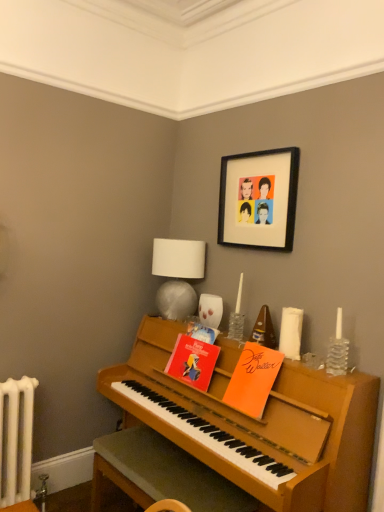
What is the approximate height of black matte picture frame at upper center?

black matte picture frame at upper center is 21.37 inches tall.

The width and height of the screenshot is (384, 512). Describe the element at coordinates (259, 199) in the screenshot. I see `black matte picture frame at upper center` at that location.

Describe the element at coordinates (161, 473) in the screenshot. The image size is (384, 512). I see `wooden piano bench at center` at that location.

What do you see at coordinates (177, 275) in the screenshot? The image size is (384, 512). I see `white fabric lampshade at upper center` at bounding box center [177, 275].

Find the location of a particular element. This screenshot has width=384, height=512. clear glass candle at right is located at coordinates (337, 350).

Find the location of a particular element. black matte picture frame at upper center is located at coordinates (259, 199).

From the image's perspective, which object appears higher, red paper book at center, the third book viewed from the right, or red paper book at center, acting as the 2th book starting from the right?

red paper book at center, acting as the 2th book starting from the right, from the image's perspective.

Is red paper book at center, positioned as the first book in left-to-right order, oriented away from red paper book at center, acting as the 2th book starting from the right?

No, red paper book at center, positioned as the first book in left-to-right order, is not facing the opposite direction of red paper book at center, acting as the 2th book starting from the right.

Between red paper book at center, the third book viewed from the right, and red paper book at center, which is the 2th book in left-to-right order, which one appears on the right side from the viewer's perspective?

From the viewer's perspective, red paper book at center, which is the 2th book in left-to-right order, appears more on the right side.

Can you confirm if red paper book at center, the third book viewed from the right, is thinner than red paper book at center, acting as the 2th book starting from the right?

Incorrect, the width of red paper book at center, the third book viewed from the right, is not less than that of red paper book at center, acting as the 2th book starting from the right.

Is the surface of white fabric lampshade at upper center in direct contact with red paper book at center, positioned as the first book in left-to-right order?

No, white fabric lampshade at upper center is not touching red paper book at center, positioned as the first book in left-to-right order.

Is white fabric lampshade at upper center facing away from red paper book at center, positioned as the first book in left-to-right order?

No, red paper book at center, positioned as the first book in left-to-right order, is not at the back of white fabric lampshade at upper center.

Does white fabric lampshade at upper center lie in front of red paper book at center, positioned as the first book in left-to-right order?

No, white fabric lampshade at upper center is behind red paper book at center, positioned as the first book in left-to-right order.

Is white fabric lampshade at upper center to the right of red paper book at center, the third book viewed from the right, from the viewer's perspective?

Incorrect, white fabric lampshade at upper center is not on the right side of red paper book at center, the third book viewed from the right.

Is clear glass candle at right positioned far away from orange matte book at center, the third book viewed from the left?

No, clear glass candle at right is not far from orange matte book at center, the third book viewed from the left.

Consider the image. From a real-world perspective, is clear glass candle at right positioned above or below orange matte book at center, the third book viewed from the left?

clear glass candle at right is situated higher than orange matte book at center, the third book viewed from the left, in the real world.

Would you say orange matte book at center, which is the first book in right-to-left order, is part of clear glass candle at right's contents?

No, orange matte book at center, which is the first book in right-to-left order, is not a part of clear glass candle at right.

Can you confirm if clear glass candle at right is positioned to the right of orange matte book at center, the third book viewed from the left?

Yes.

Considering the relative positions of red paper book at center, positioned as the first book in left-to-right order, and wooden piano bench at center in the image provided, is red paper book at center, positioned as the first book in left-to-right order, to the left or to the right of wooden piano bench at center?

red paper book at center, positioned as the first book in left-to-right order, is positioned on wooden piano bench at center's right side.

Which of these two, red paper book at center, positioned as the first book in left-to-right order, or wooden piano bench at center, is thinner?

red paper book at center, positioned as the first book in left-to-right order, is thinner.

Is red paper book at center, positioned as the first book in left-to-right order, positioned far away from wooden piano bench at center?

They are positioned close to each other.

Identify the location of table on the left of red paper book at center, positioned as the first book in left-to-right order. Image resolution: width=384 pixels, height=512 pixels. click(161, 473).

Considering the relative sizes of orange matte book at center, which is the first book in right-to-left order, and black matte picture frame at upper center in the image provided, is orange matte book at center, which is the first book in right-to-left order, thinner than black matte picture frame at upper center?

Incorrect, the width of orange matte book at center, which is the first book in right-to-left order, is not less than that of black matte picture frame at upper center.

From the picture: Can you confirm if orange matte book at center, which is the first book in right-to-left order, is smaller than black matte picture frame at upper center?

Yes.

Image resolution: width=384 pixels, height=512 pixels. In order to click on the 2nd book directly beneath the black matte picture frame at upper center (from a real-world perspective) in this screenshot , I will do point(253,379).

Consider the image. Would you say orange matte book at center, which is the first book in right-to-left order, is inside or outside black matte picture frame at upper center?

orange matte book at center, which is the first book in right-to-left order, lies outside black matte picture frame at upper center.

From a real-world perspective, which object stands above the other?

clear glass candle at right, from a real-world perspective.

Which is nearer, (184, 338) or (345, 367)?

Point (184, 338) appears to be farther away from the viewer than point (345, 367).

Are red paper book at center, positioned as the first book in left-to-right order, and clear glass candle at right beside each other?

No, red paper book at center, positioned as the first book in left-to-right order, is not with clear glass candle at right.

In the scene shown: From the image's perspective, is wooden piano bench at center under orange matte book at center, which is the first book in right-to-left order?

Yes, from the image's perspective, wooden piano bench at center is beneath orange matte book at center, which is the first book in right-to-left order.

Is wooden piano bench at center surrounding orange matte book at center, the third book viewed from the left?

No, orange matte book at center, the third book viewed from the left, is not a part of wooden piano bench at center.

Would you consider wooden piano bench at center to be distant from orange matte book at center, the third book viewed from the left?

No, wooden piano bench at center is not far from orange matte book at center, the third book viewed from the left.

From their relative heights in the image, would you say wooden piano bench at center is taller or shorter than orange matte book at center, which is the first book in right-to-left order?

Considering their sizes, wooden piano bench at center has more height than orange matte book at center, which is the first book in right-to-left order.

I want to click on book on the left of red paper book at center, which is the 2th book in left-to-right order, so [x=192, y=361].

Where is `table lamp that is above the red paper book at center, positioned as the first book in left-to-right order (from the image's perspective)`? table lamp that is above the red paper book at center, positioned as the first book in left-to-right order (from the image's perspective) is located at coordinates (177, 275).

Estimate the real-world distances between objects in this image. Which object is closer to black matte picture frame at upper center, white fabric lampshade at upper center or wooden piano bench at center?

Among the two, white fabric lampshade at upper center is located nearer to black matte picture frame at upper center.

Based on their spatial positions, is wooden piano bench at center or red paper book at center, the third book viewed from the right, closer to black matte picture frame at upper center?

Among the two, red paper book at center, the third book viewed from the right, is located nearer to black matte picture frame at upper center.

When comparing their distances from red paper book at center, which is the 2th book in left-to-right order, does orange matte book at center, the third book viewed from the left, or red paper book at center, the third book viewed from the right, seem closer?

Based on the image, red paper book at center, the third book viewed from the right, appears to be nearer to red paper book at center, which is the 2th book in left-to-right order.

Looking at the image, which one is located closer to red paper book at center, positioned as the first book in left-to-right order, wooden piano bench at center or white fabric lampshade at upper center?

Among the two, white fabric lampshade at upper center is located nearer to red paper book at center, positioned as the first book in left-to-right order.

Considering their positions, is red paper book at center, positioned as the first book in left-to-right order, positioned further to black matte picture frame at upper center than wooden piano bench at center?

Among the two, wooden piano bench at center is located further to black matte picture frame at upper center.

Which object lies nearer to the anchor point white fabric lampshade at upper center, clear glass candle at right or orange matte book at center, the third book viewed from the left?

orange matte book at center, the third book viewed from the left, is positioned closer to the anchor white fabric lampshade at upper center.

Which object lies nearer to the anchor point red paper book at center, which is the 2th book in left-to-right order, red paper book at center, the third book viewed from the right, or orange matte book at center, which is the first book in right-to-left order?

red paper book at center, the third book viewed from the right, lies closer to red paper book at center, which is the 2th book in left-to-right order, than the other object.

Consider the image. When comparing their distances from black matte picture frame at upper center, does wooden piano bench at center or white fabric lampshade at upper center seem closer?

The object closer to black matte picture frame at upper center is white fabric lampshade at upper center.

In order to click on candle holder that lies between white fabric lampshade at upper center and wooden piano bench at center from top to bottom in this screenshot , I will do `click(337, 350)`.

Locate an element on the screen. The height and width of the screenshot is (512, 384). book between black matte picture frame at upper center and red paper book at center, the third book viewed from the right, vertically is located at coordinates (202, 332).

Image resolution: width=384 pixels, height=512 pixels. I want to click on book that lies between red paper book at center, the third book viewed from the right, and wooden piano bench at center from top to bottom, so tap(253, 379).

Identify the location of book positioned between orange matte book at center, the third book viewed from the left, and red paper book at center, which is the 2th book in left-to-right order, from near to far. This screenshot has height=512, width=384. (192, 361).